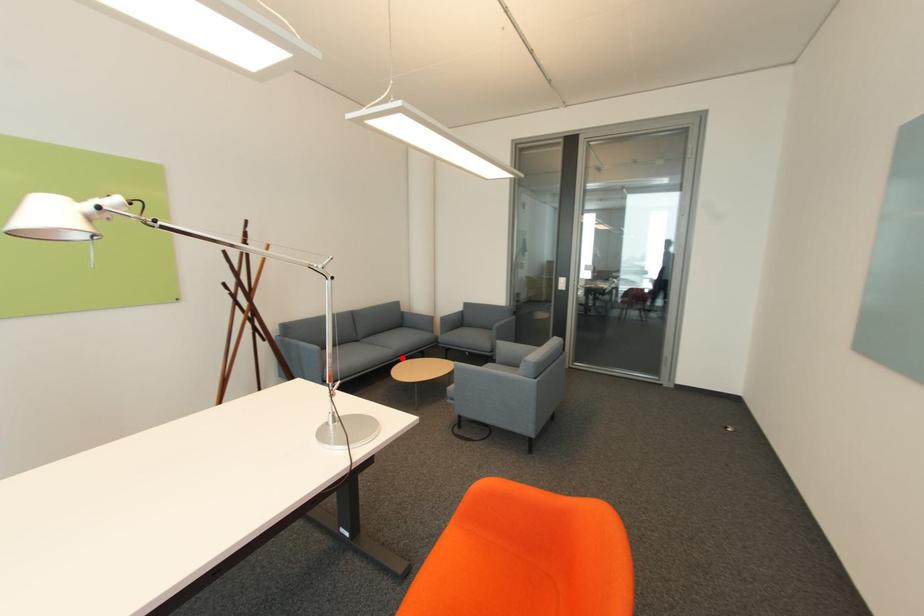
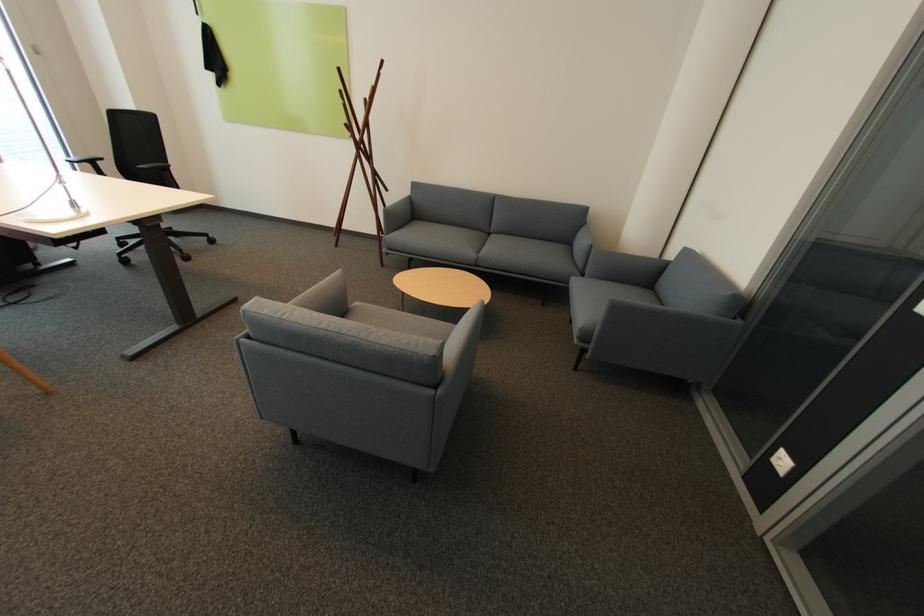
In the second image, find the point that corresponds to the highlighted location in the first image.

(482, 265)